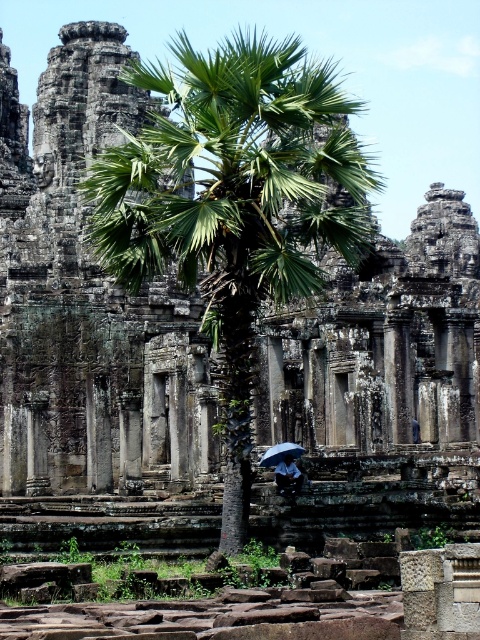
Can you confirm if dark blue fabric umbrella at center is positioned to the left of transparent plastic umbrella at center?

No, dark blue fabric umbrella at center is not to the left of transparent plastic umbrella at center.

Can you confirm if dark blue fabric umbrella at center is smaller than transparent plastic umbrella at center?

No, dark blue fabric umbrella at center is not smaller than transparent plastic umbrella at center.

Which is behind, point (284, 467) or point (266, 460)?

Point (266, 460)

Identify the location of dark blue fabric umbrella at center. (288, 476).